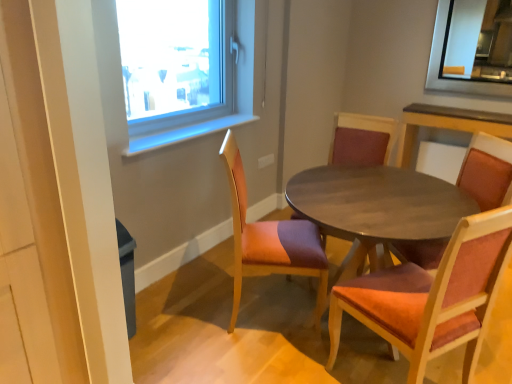
Question: Does wooden chair with red cushion at center, placed as the third chair when sorted from right to left, have a smaller size compared to wooden table at center?

Choices:
 (A) no
 (B) yes

Answer: (B)

Question: Does wooden chair with red cushion at center, placed as the third chair when sorted from right to left, have a greater height compared to wooden table at center?

Choices:
 (A) yes
 (B) no

Answer: (A)

Question: Is wooden chair with red cushion at center, which appears as the 2th chair when viewed from the left, positioned with its back to wooden table at center?

Choices:
 (A) no
 (B) yes

Answer: (B)

Question: Is wooden chair with red cushion at center, which appears as the 2th chair when viewed from the left, oriented towards wooden table at center?

Choices:
 (A) yes
 (B) no

Answer: (A)

Question: Does wooden chair with red cushion at center, which appears as the 2th chair when viewed from the left, appear on the right side of wooden table at center?

Choices:
 (A) no
 (B) yes

Answer: (A)

Question: In the image, is velvet orange chair at center, the 3th chair positioned from the left, positioned in front of or behind wooden table at center?

Choices:
 (A) behind
 (B) front

Answer: (B)

Question: Based on their positions, is velvet orange chair at center, the 3th chair positioned from the left, located to the left or right of wooden table at center?

Choices:
 (A) right
 (B) left

Answer: (A)

Question: Do you think velvet orange chair at center, the second chair positioned from the right, is within wooden table at center, or outside of it?

Choices:
 (A) inside
 (B) outside

Answer: (A)

Question: Is velvet orange chair at center, the 3th chair positioned from the left, bigger or smaller than wooden table at center?

Choices:
 (A) big
 (B) small

Answer: (B)

Question: In terms of height, does wooden textured chair at center, the 1th chair in the right-to-left sequence, look taller or shorter compared to wooden textured chair at center, placed as the 4th chair when sorted from right to left?

Choices:
 (A) short
 (B) tall

Answer: (B)

Question: Is wooden textured chair at center, the 1th chair in the right-to-left sequence, bigger or smaller than wooden textured chair at center, placed as the 4th chair when sorted from right to left?

Choices:
 (A) small
 (B) big

Answer: (B)

Question: Choose the correct answer: Is wooden textured chair at center, the 4th chair when ordered from left to right, inside wooden textured chair at center, placed as the 4th chair when sorted from right to left, or outside it?

Choices:
 (A) inside
 (B) outside

Answer: (B)

Question: From a real-world perspective, relative to wooden textured chair at center, placed as the 4th chair when sorted from right to left, is wooden textured chair at center, the 4th chair when ordered from left to right, vertically above or below?

Choices:
 (A) above
 (B) below

Answer: (A)

Question: Is wooden textured chair at center, acting as the first chair starting from the left, taller or shorter than wooden chair with red cushion at center, placed as the third chair when sorted from right to left?

Choices:
 (A) tall
 (B) short

Answer: (B)

Question: Considering their positions, is wooden textured chair at center, acting as the first chair starting from the left, located in front of or behind wooden chair with red cushion at center, placed as the third chair when sorted from right to left?

Choices:
 (A) behind
 (B) front

Answer: (B)